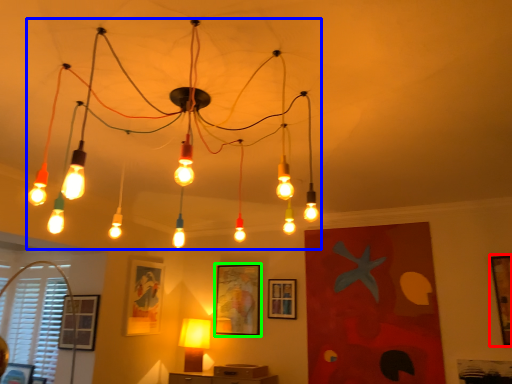
Question: Based on their relative distances, which object is farther from picture frame (highlighted by a red box)? Choose from lamp (highlighted by a blue box) and picture frame (highlighted by a green box).

Choices:
 (A) lamp
 (B) picture frame

Answer: (A)